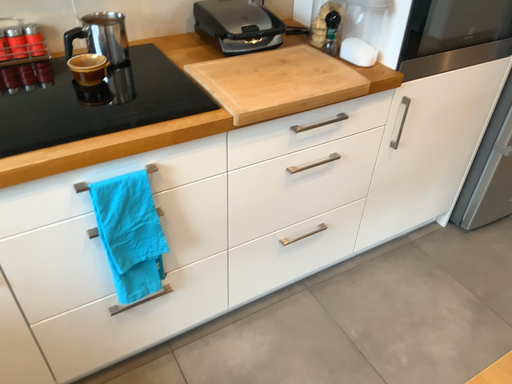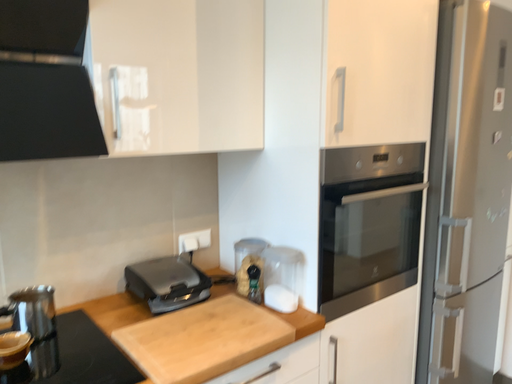
Question: How did the camera likely rotate when shooting the video?

Choices:
 (A) rotated downward
 (B) rotated upward

Answer: (B)